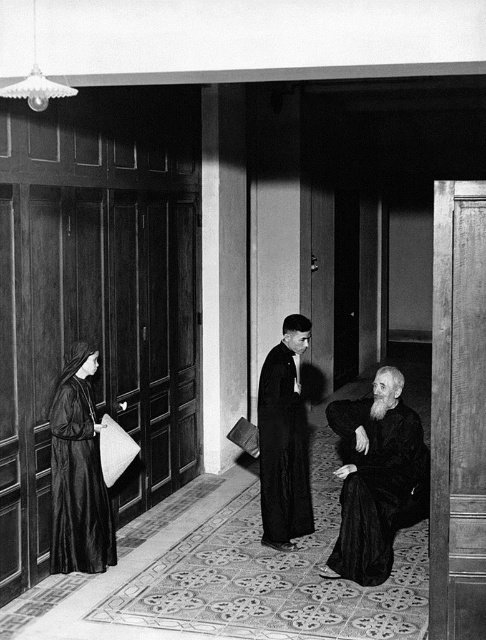
Question: Does matte black robe at left lie in front of smooth black robe at center?

Choices:
 (A) no
 (B) yes

Answer: (B)

Question: Which point is closer to the camera?

Choices:
 (A) matte black robe at left
 (B) smooth black robe at center

Answer: (A)

Question: Which point appears closest to the camera in this image?

Choices:
 (A) tap(285, 490)
 (B) tap(56, 445)
 (C) tap(343, 568)

Answer: (C)

Question: Which of these objects is positioned closest to the black matte robe at lower right?

Choices:
 (A) matte black robe at left
 (B) smooth black robe at center

Answer: (B)

Question: Is matte black robe at left positioned in front of smooth black robe at center?

Choices:
 (A) no
 (B) yes

Answer: (B)

Question: Observing the image, what is the correct spatial positioning of matte black robe at left in reference to smooth black robe at center?

Choices:
 (A) left
 (B) right

Answer: (A)